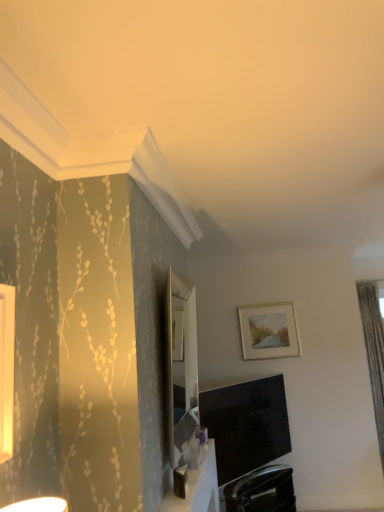
Question: From the image's perspective, is matte black tv at lower center above matte white picture frame at upper right?

Choices:
 (A) yes
 (B) no

Answer: (B)

Question: From a real-world perspective, is matte black tv at lower center on top of matte white picture frame at upper right?

Choices:
 (A) no
 (B) yes

Answer: (A)

Question: Considering the relative positions of matte black tv at lower center and matte white picture frame at upper right in the image provided, is matte black tv at lower center to the right of matte white picture frame at upper right from the viewer's perspective?

Choices:
 (A) yes
 (B) no

Answer: (B)

Question: Is matte black tv at lower center turned away from matte white picture frame at upper right?

Choices:
 (A) yes
 (B) no

Answer: (B)

Question: Is matte black tv at lower center bigger than matte white picture frame at upper right?

Choices:
 (A) no
 (B) yes

Answer: (B)

Question: Is matte white picture frame at upper right inside matte black tv at lower center?

Choices:
 (A) yes
 (B) no

Answer: (B)

Question: Considering the relative sizes of gray textured curtain at right and black leather swivel chair at lower center in the image provided, is gray textured curtain at right shorter than black leather swivel chair at lower center?

Choices:
 (A) no
 (B) yes

Answer: (A)

Question: From a real-world perspective, is gray textured curtain at right positioned over black leather swivel chair at lower center based on gravity?

Choices:
 (A) yes
 (B) no

Answer: (A)

Question: Considering the relative positions of gray textured curtain at right and black leather swivel chair at lower center in the image provided, is gray textured curtain at right to the left of black leather swivel chair at lower center from the viewer's perspective?

Choices:
 (A) yes
 (B) no

Answer: (B)

Question: Could you tell me if gray textured curtain at right is turned towards black leather swivel chair at lower center?

Choices:
 (A) yes
 (B) no

Answer: (B)

Question: Is gray textured curtain at right positioned beyond the bounds of black leather swivel chair at lower center?

Choices:
 (A) yes
 (B) no

Answer: (A)

Question: Does gray textured curtain at right have a smaller size compared to black leather swivel chair at lower center?

Choices:
 (A) no
 (B) yes

Answer: (A)

Question: Is white glossy table at lower center not within matte white picture frame at upper right?

Choices:
 (A) no
 (B) yes

Answer: (B)